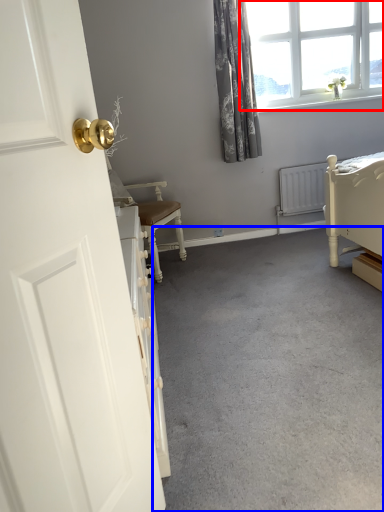
Question: Among these objects, which one is farthest to the camera, window (highlighted by a red box) or concrete (highlighted by a blue box)?

Choices:
 (A) window
 (B) concrete

Answer: (A)